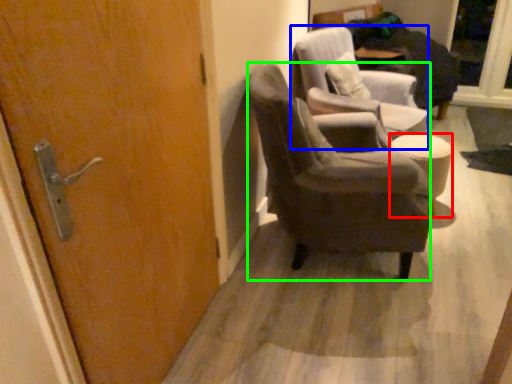
Question: Estimate the real-world distances between objects in this image. Which object is closer to stool (highlighted by a red box), chair (highlighted by a blue box) or chair (highlighted by a green box)?

Choices:
 (A) chair
 (B) chair

Answer: (A)